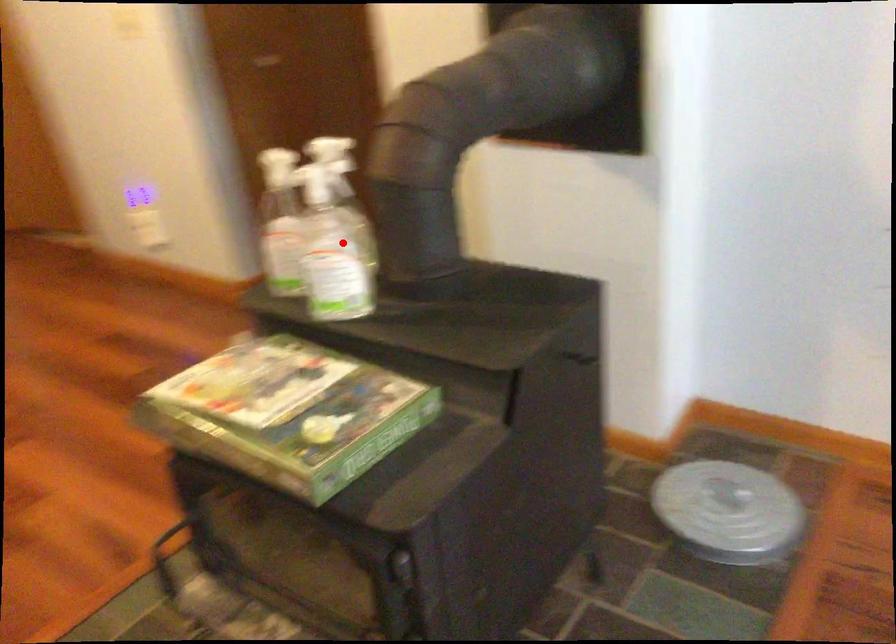
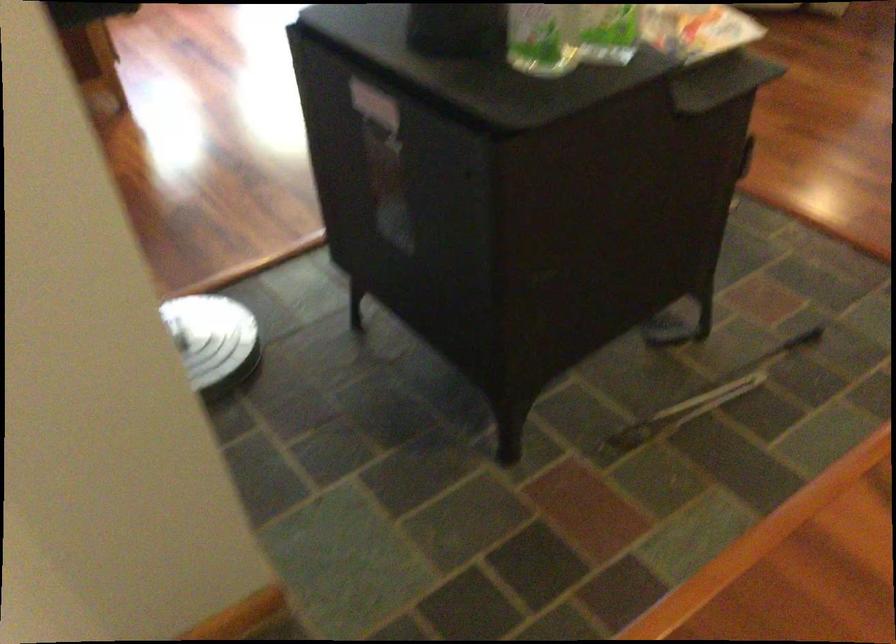
Question: I am providing you with two images of the same scene from different viewpoints. Given a red point in image1, look at the same physical point in image2. Is it:

Choices:
 (A) Closer to the viewpoint
 (B) Farther from the viewpoint

Answer: (A)